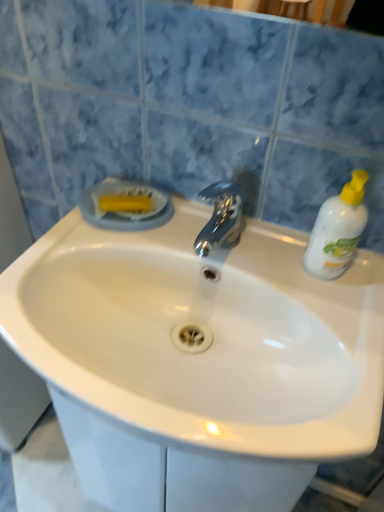
Question: From a real-world perspective, relative to white glossy sink at center, is white plastic bottle at right vertically above or below?

Choices:
 (A) below
 (B) above

Answer: (B)

Question: Based on their positions, is white plastic bottle at right located to the left or right of white glossy sink at center?

Choices:
 (A) left
 (B) right

Answer: (B)

Question: From the image's perspective, is white plastic bottle at right located above or below white glossy sink at center?

Choices:
 (A) below
 (B) above

Answer: (B)

Question: Is white glossy sink at center wider or thinner than white plastic bottle at right?

Choices:
 (A) thin
 (B) wide

Answer: (B)

Question: Is point (180, 422) positioned closer to the camera than point (327, 267)?

Choices:
 (A) closer
 (B) farther

Answer: (A)

Question: From the image's perspective, is white glossy sink at center located above or below white plastic bottle at right?

Choices:
 (A) above
 (B) below

Answer: (B)

Question: From a real-world perspective, is white glossy sink at center above or below white plastic bottle at right?

Choices:
 (A) below
 (B) above

Answer: (A)